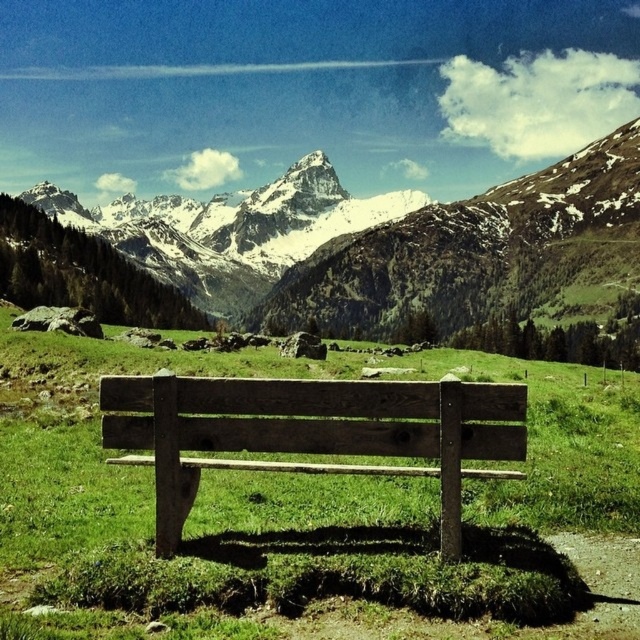
You are planning to take a photo of the snowy granite mountain range at upper center and the weathered wood bench at center. Which object should you focus on first if you want to capture both in the same frame without moving the camera?

The snowy granite mountain range at upper center is wider than the weathered wood bench at center, so you should focus on the wider object first to ensure it fits in the frame.

You are planning to take a photo of the snowy granite mountain range at upper center and the weathered wood bench at center. Since you want both to be in the same frame, which object should you position closer to the left side of your camera viewfinder?

The snowy granite mountain range at upper center should be positioned closer to the left side of your camera viewfinder because it is already on the left side of the weathered wood bench at center in the scene.

You are planning to take a photo of the snowy granite mountain range at upper center and the weathered wood bench at center. Which object should you focus on first if you want to capture both in a single frame without moving the camera?

The snowy granite mountain range at upper center is larger in size compared to the weathered wood bench at center, so you should focus on the snowy granite mountain range at upper center first to ensure it fills the frame appropriately before adjusting for the smaller bench.